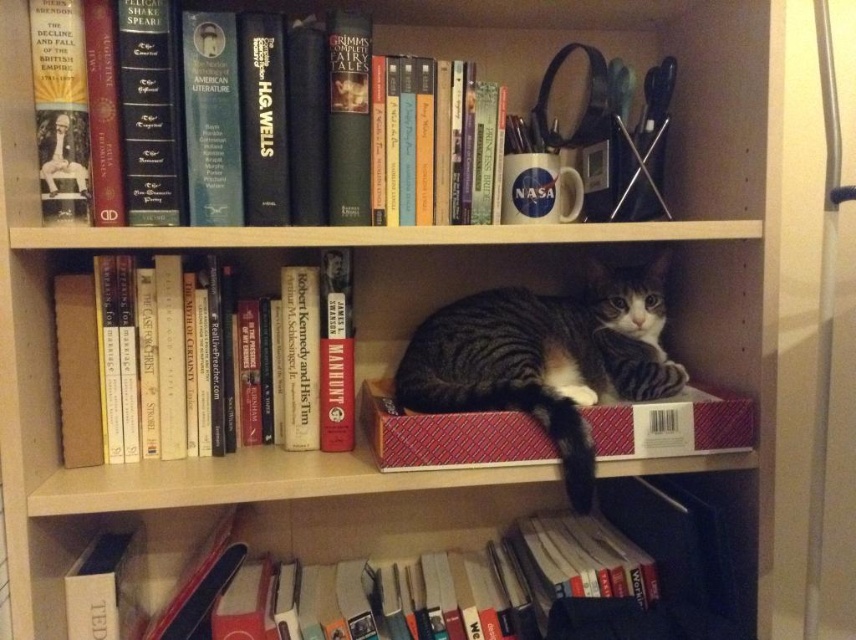
You are organizing the bookshelf and want to place a new book between the hardcover book at center and the hardcover book at lower center. Can you do this without moving either of the existing books?

The hardcover book at center is in front of the hardcover book at lower center, so you can place the new book between them by positioning it behind the hardcover book at center but in front of the hardcover book at lower center.

Consider the image. You are organizing a bookshelf and need to place a new book. The bookshelf has three shelves. The top shelf has books and items like a NASA mug and scissors. The middle shelf has a striped fur cat at center. Where should you place the new book to avoid disturbing the cat?

You should place the new book on the top shelf or the bottom shelf to avoid disturbing the striped fur cat at center on the middle shelf.